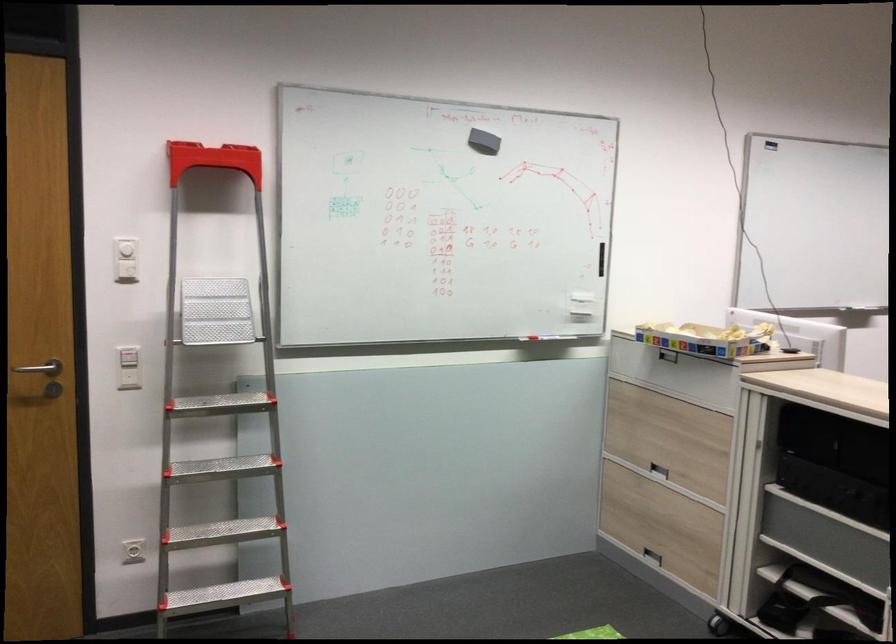
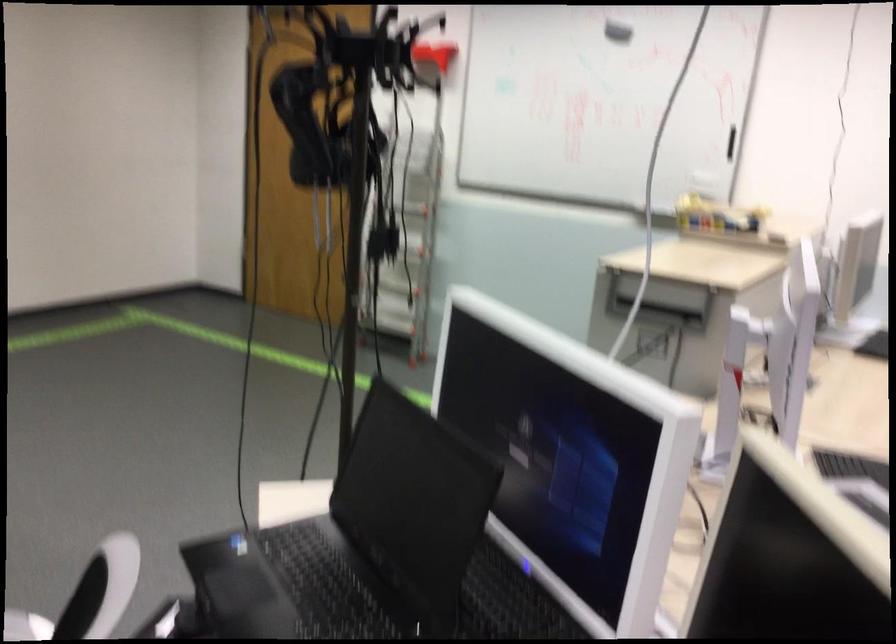
Where in the second image is the point corresponding to point (487, 154) from the first image?

(617, 32)